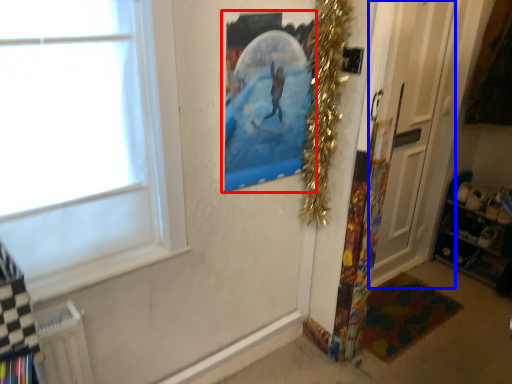
Question: Which point is further to the camera, picture frame (highlighted by a red box) or door (highlighted by a blue box)?

Choices:
 (A) picture frame
 (B) door

Answer: (B)